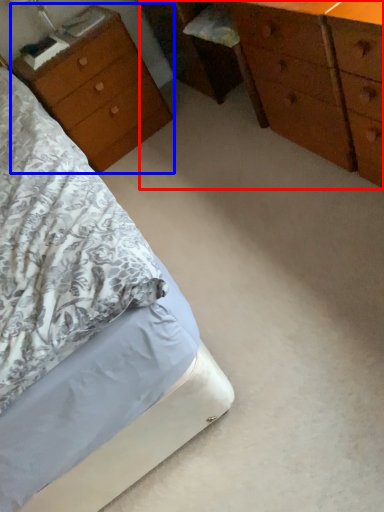
Question: Which of the following is the farthest to the observer, chest of drawers (highlighted by a red box) or nightstand (highlighted by a blue box)?

Choices:
 (A) chest of drawers
 (B) nightstand

Answer: (B)